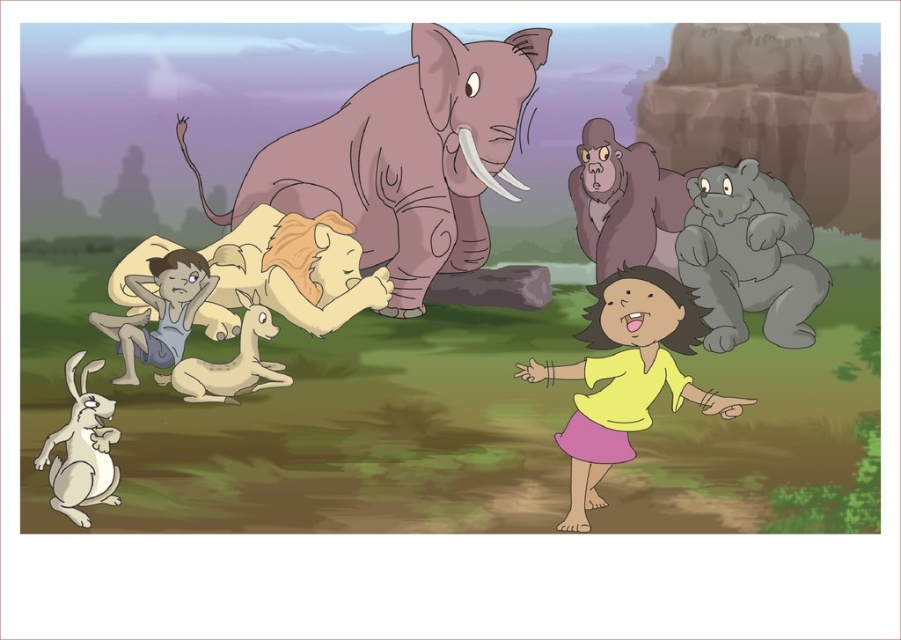
Can you confirm if purple matte elephant at center is wider than white fur antelope at center?

Yes, purple matte elephant at center is wider than white fur antelope at center.

Between point (493, 148) and point (199, 384), which one is positioned in front?

Point (493, 148) is more forward.

Between point (481, 252) and point (223, 369), which one is positioned behind?

The point (481, 252) is behind.

Where is `purple matte elephant at center`? The height and width of the screenshot is (640, 901). purple matte elephant at center is located at coordinates tap(413, 168).

Does gray matte elephant at upper center have a larger size compared to white matte rabbit at lower left?

Yes.

Is gray matte elephant at upper center taller than white matte rabbit at lower left?

Incorrect, gray matte elephant at upper center's height is not larger of white matte rabbit at lower left's.

Identify the location of gray matte elephant at upper center. (624, 202).

Is purple matte elephant at center in front of gray matte elephant at upper center?

Yes, it is.

Who is taller, purple matte elephant at center or gray matte elephant at upper center?

purple matte elephant at center is taller.

Is point (401, 136) less distant than point (658, 264)?

Yes, point (401, 136) is closer to viewer.

Identify the location of purple matte elephant at center. The width and height of the screenshot is (901, 640). (413, 168).